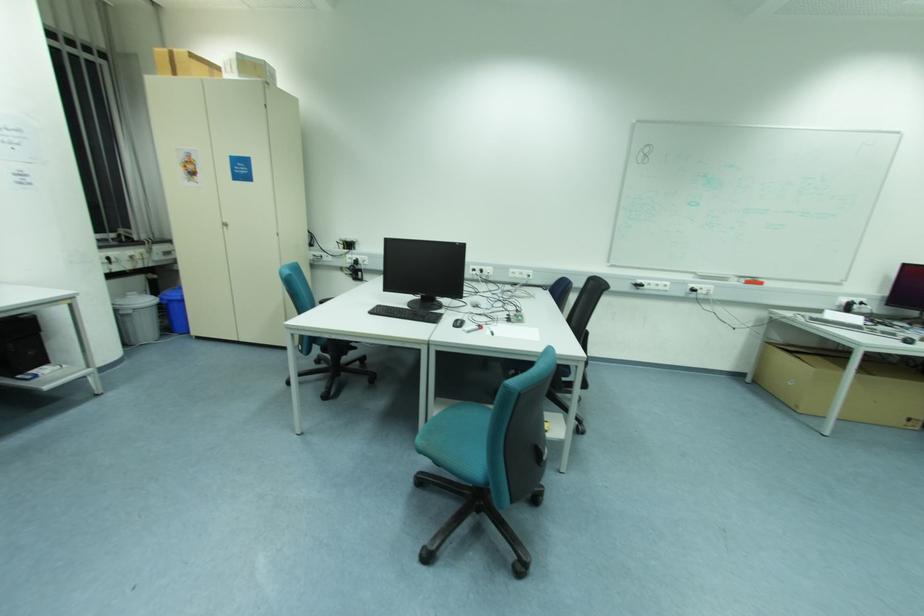
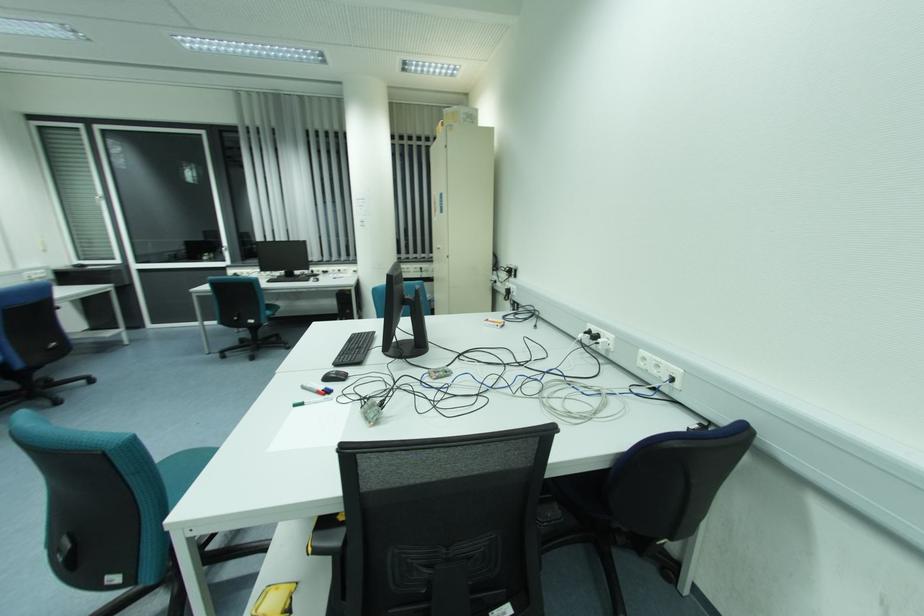
Find the pixel in the second image that matches (x=475, y=270) in the first image.

(590, 333)